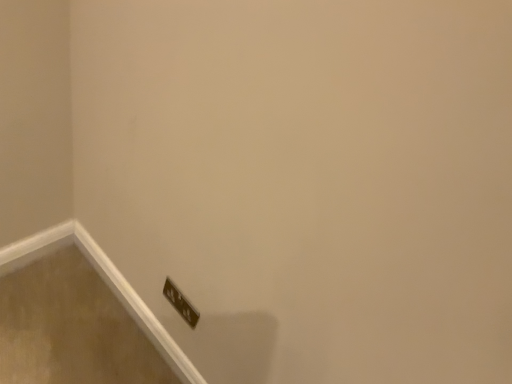
The image size is (512, 384). I want to click on satin silver light switch at lower center, so click(180, 303).

This screenshot has height=384, width=512. What do you see at coordinates (180, 303) in the screenshot?
I see `satin silver light switch at lower center` at bounding box center [180, 303].

Measure the distance between satin silver light switch at lower center and camera.

satin silver light switch at lower center is 3.80 feet away from camera.

Locate an element on the screen. satin silver light switch at lower center is located at coordinates (180, 303).